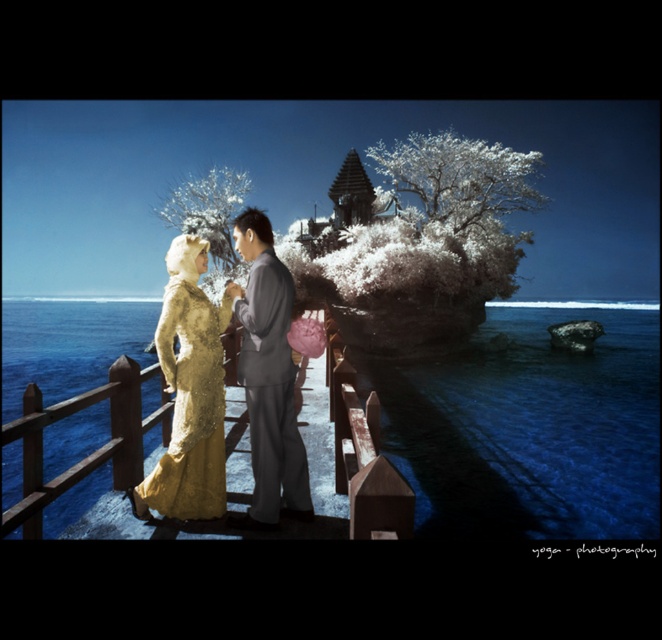
You are a photographer planning to capture the two people on the wooden pier while ensuring the blue water at center and blue water at lower center are both visible in the frame. Which part of the water should you focus on to include both areas in your composition?

To include both the blue water at center and blue water at lower center in the frame, focus on the blue water at lower center since it is positioned below the blue water at center, allowing the upper area to naturally include the lower section in the composition.